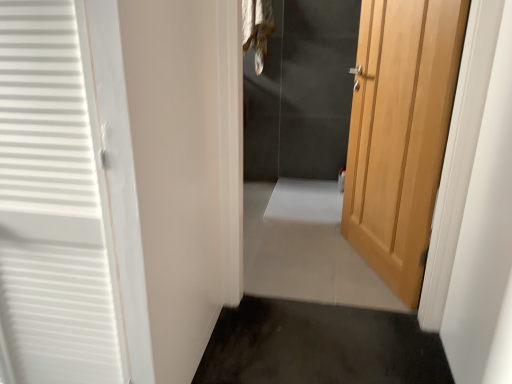
Question: From the image's perspective, is dark gray carpet at lower center, the first path from the bottom, below fur-like fabric at upper center?

Choices:
 (A) yes
 (B) no

Answer: (A)

Question: Considering the relative sizes of dark gray carpet at lower center, which ranks as the 2th path in top-to-bottom order, and fur-like fabric at upper center in the image provided, is dark gray carpet at lower center, which ranks as the 2th path in top-to-bottom order, thinner than fur-like fabric at upper center?

Choices:
 (A) yes
 (B) no

Answer: (B)

Question: Can you confirm if dark gray carpet at lower center, the first path from the bottom, is smaller than fur-like fabric at upper center?

Choices:
 (A) yes
 (B) no

Answer: (B)

Question: Is dark gray carpet at lower center, acting as the second path starting from the back, to the right of fur-like fabric at upper center from the viewer's perspective?

Choices:
 (A) no
 (B) yes

Answer: (B)

Question: Is dark gray carpet at lower center, which ranks as the 2th path in top-to-bottom order, at the left side of fur-like fabric at upper center?

Choices:
 (A) yes
 (B) no

Answer: (B)

Question: In terms of size, does white tile floor at center, the 2th path viewed from the front, appear bigger or smaller than dark gray carpet at lower center, the first path from the front?

Choices:
 (A) big
 (B) small

Answer: (A)

Question: Is white tile floor at center, the 2th path viewed from the front, in front of or behind dark gray carpet at lower center, the first path from the front, in the image?

Choices:
 (A) behind
 (B) front

Answer: (A)

Question: From a real-world perspective, relative to dark gray carpet at lower center, which ranks as the 2th path in top-to-bottom order, is white tile floor at center, the 2th path viewed from the front, vertically above or below?

Choices:
 (A) below
 (B) above

Answer: (B)

Question: Does point (300, 188) appear closer or farther from the camera than point (357, 311)?

Choices:
 (A) farther
 (B) closer

Answer: (A)

Question: Considering the positions of dark gray carpet at lower center, acting as the second path starting from the back, and fur-like fabric at upper center in the image, is dark gray carpet at lower center, acting as the second path starting from the back, wider or thinner than fur-like fabric at upper center?

Choices:
 (A) thin
 (B) wide

Answer: (B)

Question: Considering their positions, is dark gray carpet at lower center, acting as the second path starting from the back, located in front of or behind fur-like fabric at upper center?

Choices:
 (A) behind
 (B) front

Answer: (B)

Question: In terms of size, does dark gray carpet at lower center, which ranks as the 2th path in top-to-bottom order, appear bigger or smaller than fur-like fabric at upper center?

Choices:
 (A) big
 (B) small

Answer: (A)

Question: Is point (429, 342) positioned closer to the camera than point (266, 24)?

Choices:
 (A) farther
 (B) closer

Answer: (B)

Question: Is light wood door at right to the left or to the right of dark gray carpet at lower center, acting as the second path starting from the back, in the image?

Choices:
 (A) left
 (B) right

Answer: (B)

Question: From the image's perspective, is light wood door at right above or below dark gray carpet at lower center, the first path from the bottom?

Choices:
 (A) above
 (B) below

Answer: (A)